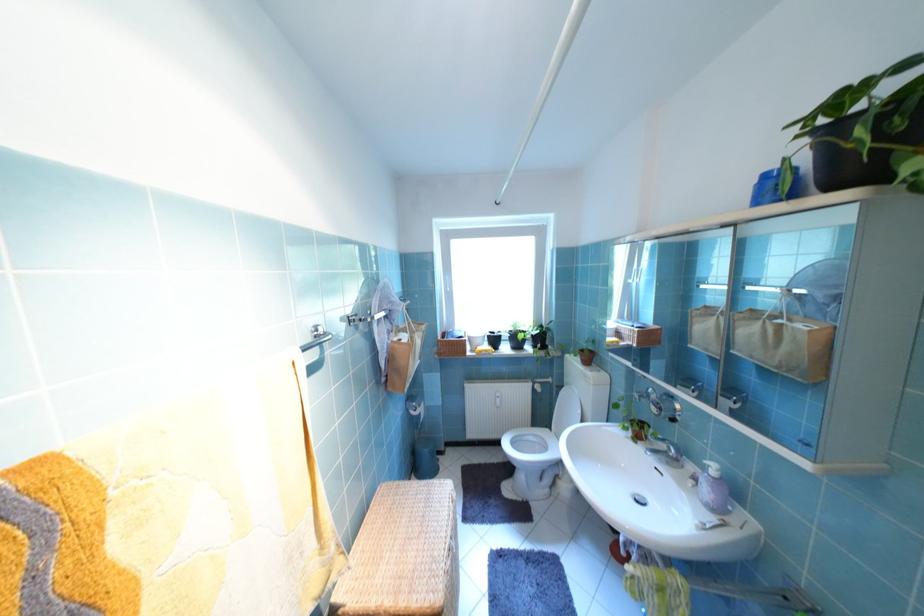
The location [773,187] corresponds to which object?

It refers to a blue plastic container.